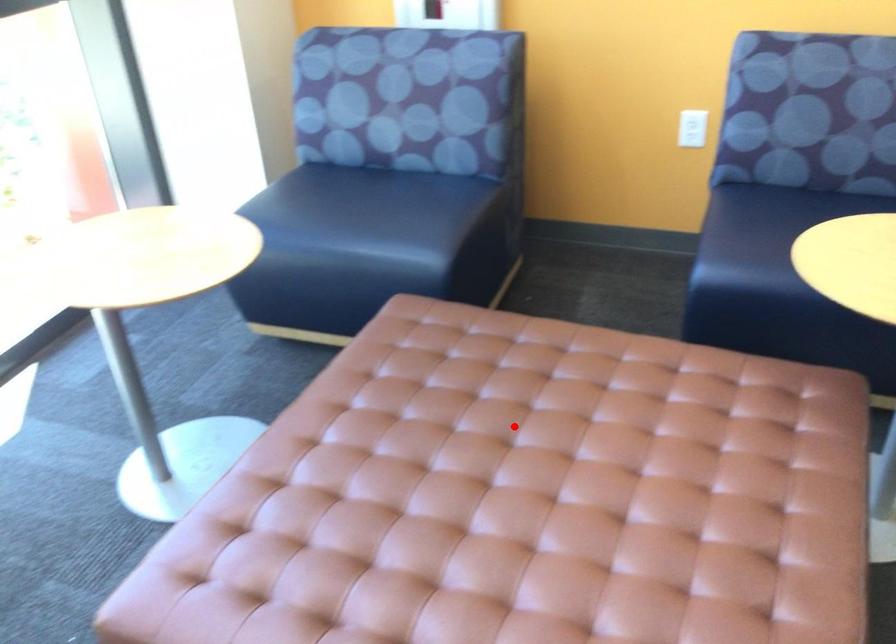
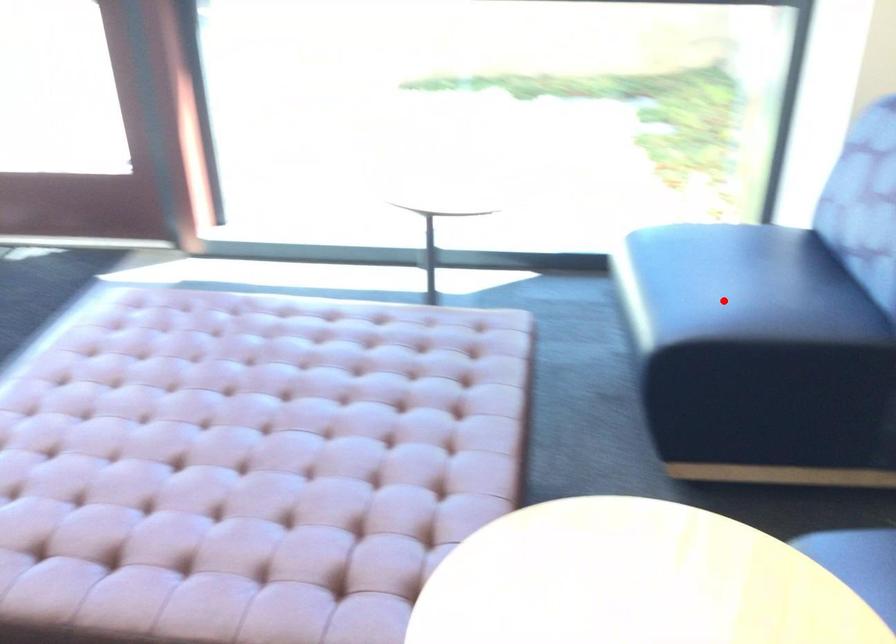
I am providing you with two images of the same scene from different viewpoints. A red point is marked on the first image and another point is marked on the second image. Does the point marked in image1 correspond to the same location as the one in image2?

No